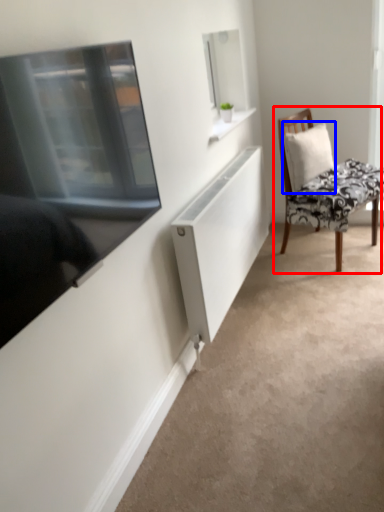
Question: Which of the following is the farthest to the observer, chair (highlighted by a red box) or pillow (highlighted by a blue box)?

Choices:
 (A) chair
 (B) pillow

Answer: (B)